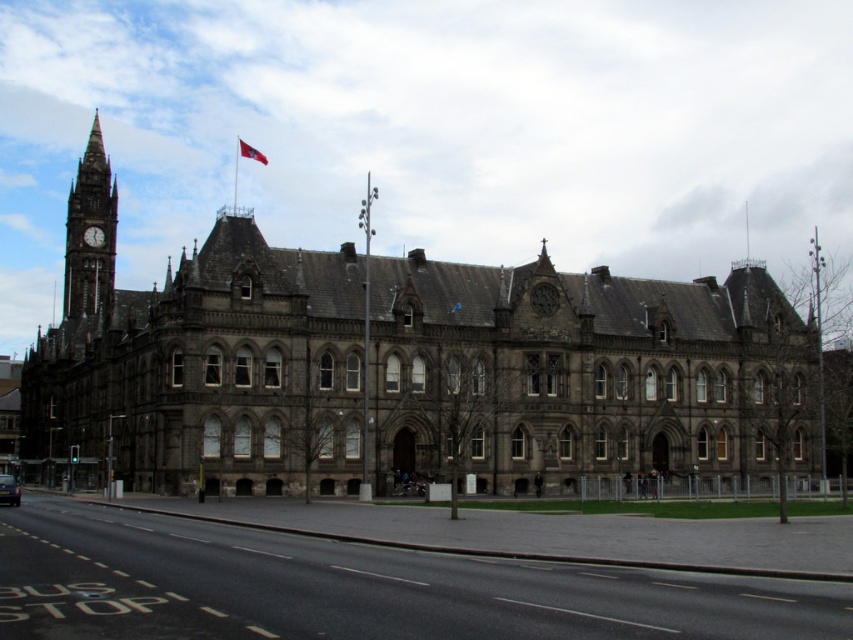
Consider the image. You are a tourist standing at the base of the historic building. You notice two red fabric flags. Which flag, the red fabric flag at upper center or the red fabric flag at center, is larger in size?

The red fabric flag at upper center is bigger than the red fabric flag at center.